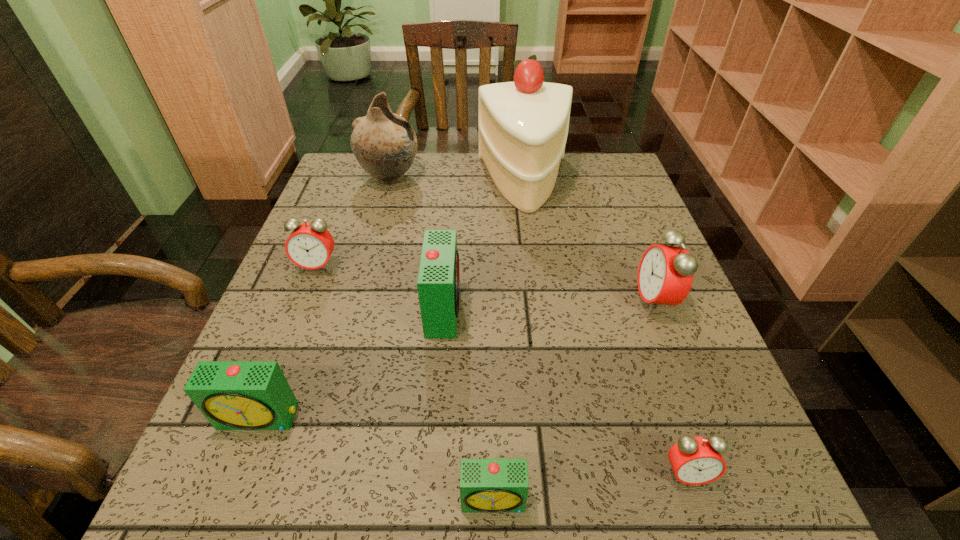
The image size is (960, 540). What are the coordinates of `vacant point located between the pottery and the smallest green alarm clock` in the screenshot? It's located at [x=442, y=339].

This screenshot has width=960, height=540. Find the location of `vacant space that is in between the pottery and the tallest object`. vacant space that is in between the pottery and the tallest object is located at coordinates (457, 180).

Identify the location of free space between the sixth nearest object and the rightmost green alarm clock. This screenshot has height=540, width=960. (406, 383).

At what (x,y) coordinates should I click in order to perform the action: click on object that stands as the second closest to the nearest red alarm clock. Please return your answer as a coordinate pair (x, y). Looking at the image, I should click on (665, 274).

At what (x,y) coordinates should I click in order to perform the action: click on object that is the fifth nearest to the smallest green alarm clock. Please return your answer as a coordinate pair (x, y). The height and width of the screenshot is (540, 960). Looking at the image, I should click on (310, 245).

At what (x,y) coordinates should I click in order to perform the action: click on alarm clock object that ranks as the third closest to the tallest object. Please return your answer as a coordinate pair (x, y). This screenshot has width=960, height=540. Looking at the image, I should click on (310, 245).

The height and width of the screenshot is (540, 960). I want to click on alarm clock identified as the fourth closest to the farthest red alarm clock, so click(665, 274).

Identify which red alarm clock is the nearest to the second nearest red alarm clock. Please provide its 2D coordinates. Your answer should be formatted as a tuple, i.e. [(x, y)], where the tuple contains the x and y coordinates of a point satisfying the conditions above.

[(695, 460)]

Select which red alarm clock appears as the second closest to the second biggest green alarm clock. Please provide its 2D coordinates. Your answer should be formatted as a tuple, i.e. [(x, y)], where the tuple contains the x and y coordinates of a point satisfying the conditions above.

[(695, 460)]

Identify which green alarm clock is the third nearest to the biggest red alarm clock. Please provide its 2D coordinates. Your answer should be formatted as a tuple, i.e. [(x, y)], where the tuple contains the x and y coordinates of a point satisfying the conditions above.

[(233, 395)]